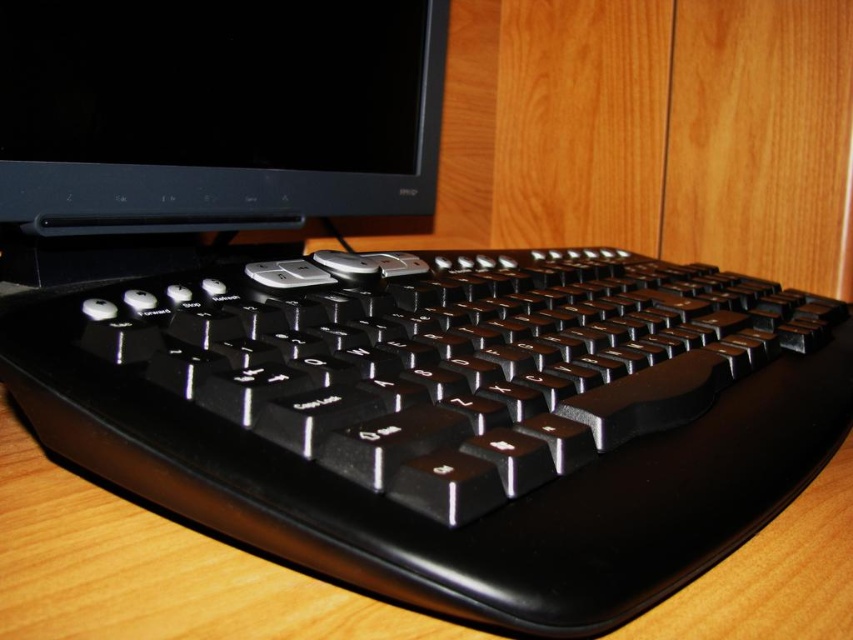
Question: Can you confirm if black plastic keyboard at center is thinner than black glossy monitor at upper left?

Choices:
 (A) yes
 (B) no

Answer: (B)

Question: Does black plastic keyboard at center appear over black glossy monitor at upper left?

Choices:
 (A) yes
 (B) no

Answer: (B)

Question: Which of the following is the farthest from the observer?

Choices:
 (A) (604, 577)
 (B) (235, 216)

Answer: (B)

Question: Is black plastic keyboard at center closer to camera compared to black glossy monitor at upper left?

Choices:
 (A) yes
 (B) no

Answer: (A)

Question: Which object appears closest to the camera in this image?

Choices:
 (A) black glossy monitor at upper left
 (B) black plastic keyboard at center

Answer: (B)